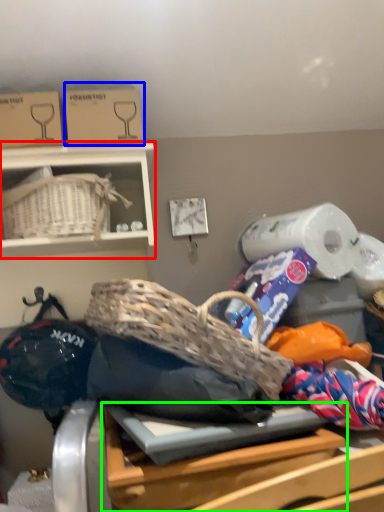
Question: Based on their relative distances, which object is nearer to furniture (highlighted by a red box)? Choose from cardboard box (highlighted by a blue box) and table (highlighted by a green box).

Choices:
 (A) cardboard box
 (B) table

Answer: (A)